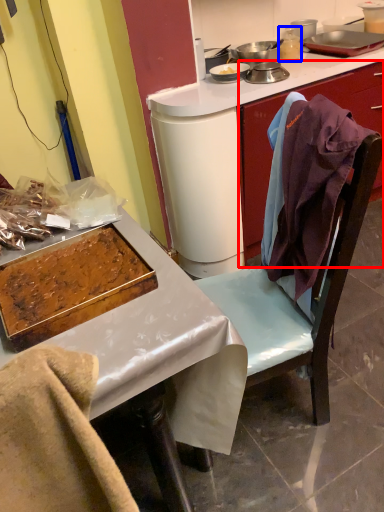
Question: Which point is further to the camera, cabinetry (highlighted by a red box) or appliance (highlighted by a blue box)?

Choices:
 (A) cabinetry
 (B) appliance

Answer: (B)